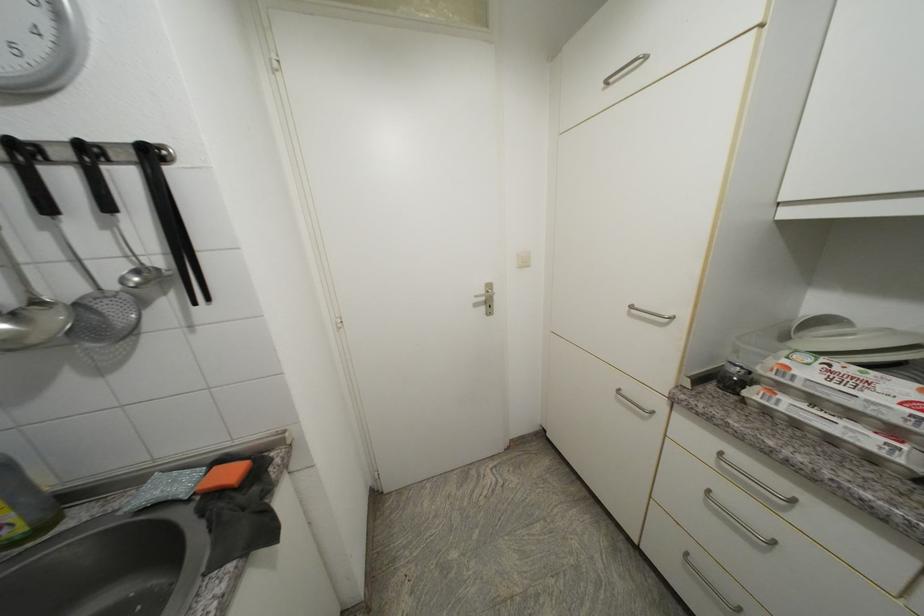
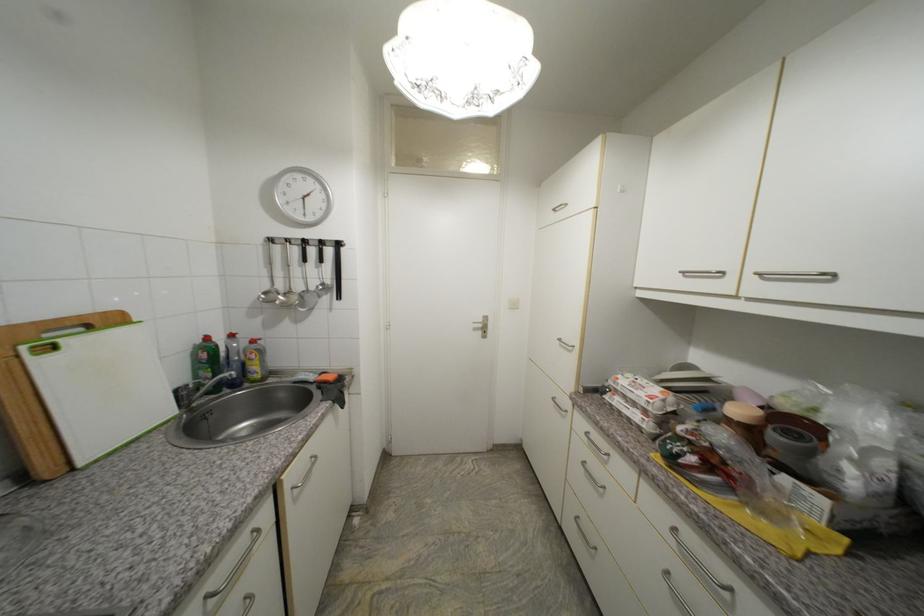
The point at (638, 309) is marked in the first image. Where is the corresponding point in the second image?

(565, 341)